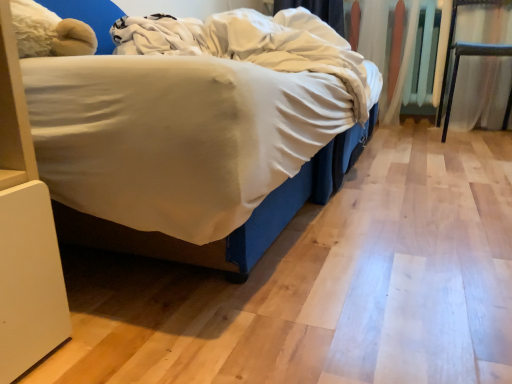
Question: From a real-world perspective, is metallic silver chair at right over white soft blanket at center?

Choices:
 (A) yes
 (B) no

Answer: (B)

Question: Is metallic silver chair at right to the left of white soft blanket at center from the viewer's perspective?

Choices:
 (A) yes
 (B) no

Answer: (B)

Question: Is metallic silver chair at right taller than white soft blanket at center?

Choices:
 (A) no
 (B) yes

Answer: (B)

Question: Could you tell me if metallic silver chair at right is turned towards white soft blanket at center?

Choices:
 (A) no
 (B) yes

Answer: (A)

Question: Is metallic silver chair at right in front of white soft blanket at center?

Choices:
 (A) yes
 (B) no

Answer: (B)

Question: Is metallic silver chair at right wider than white soft blanket at center?

Choices:
 (A) no
 (B) yes

Answer: (A)

Question: Could metallic silver chair at right be considered to be inside white soft blanket at center?

Choices:
 (A) yes
 (B) no

Answer: (B)

Question: From a real-world perspective, is white soft blanket at center physically below metallic silver chair at right?

Choices:
 (A) yes
 (B) no

Answer: (B)

Question: Considering the relative sizes of white soft blanket at center and metallic silver chair at right in the image provided, is white soft blanket at center taller than metallic silver chair at right?

Choices:
 (A) yes
 (B) no

Answer: (B)

Question: Is white soft blanket at center aimed at metallic silver chair at right?

Choices:
 (A) yes
 (B) no

Answer: (A)

Question: Can you confirm if white soft blanket at center is smaller than metallic silver chair at right?

Choices:
 (A) yes
 (B) no

Answer: (B)

Question: Does white soft blanket at center appear on the left side of metallic silver chair at right?

Choices:
 (A) no
 (B) yes

Answer: (B)

Question: Is metallic silver chair at right situated inside white soft blanket at center or outside?

Choices:
 (A) inside
 (B) outside

Answer: (B)